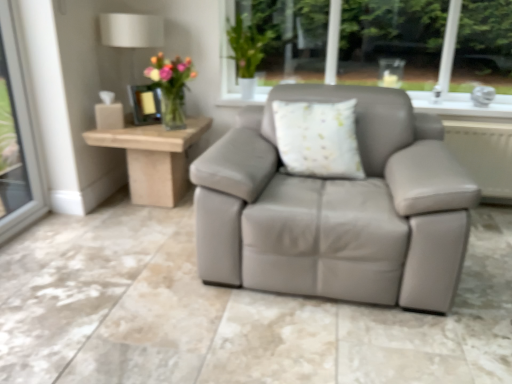
Question: Does metallic lampshade at upper left appear on the right side of green matte vase at upper center?

Choices:
 (A) yes
 (B) no

Answer: (B)

Question: From the image's perspective, would you say metallic lampshade at upper left is shown under green matte vase at upper center?

Choices:
 (A) no
 (B) yes

Answer: (B)

Question: Is metallic lampshade at upper left looking in the opposite direction of green matte vase at upper center?

Choices:
 (A) no
 (B) yes

Answer: (A)

Question: Are metallic lampshade at upper left and green matte vase at upper center far apart?

Choices:
 (A) no
 (B) yes

Answer: (A)

Question: Is metallic lampshade at upper left closer to the viewer compared to green matte vase at upper center?

Choices:
 (A) no
 (B) yes

Answer: (B)

Question: Is green matte vase at upper center surrounded by metallic lampshade at upper left?

Choices:
 (A) no
 (B) yes

Answer: (A)

Question: Can you confirm if light wood/roughobject at left is shorter than green matte vase at upper center?

Choices:
 (A) no
 (B) yes

Answer: (B)

Question: Is light wood/roughobject at left bigger than green matte vase at upper center?

Choices:
 (A) yes
 (B) no

Answer: (A)

Question: Considering the relative sizes of light wood/roughobject at left and green matte vase at upper center in the image provided, is light wood/roughobject at left taller than green matte vase at upper center?

Choices:
 (A) no
 (B) yes

Answer: (A)

Question: From a real-world perspective, is light wood/roughobject at left physically above green matte vase at upper center?

Choices:
 (A) yes
 (B) no

Answer: (B)

Question: Is light wood/roughobject at left oriented towards green matte vase at upper center?

Choices:
 (A) yes
 (B) no

Answer: (B)

Question: Is light wood/roughobject at left oriented away from green matte vase at upper center?

Choices:
 (A) yes
 (B) no

Answer: (B)

Question: Is light wood/roughobject at left bigger than translucent glass vase at upper left?

Choices:
 (A) yes
 (B) no

Answer: (A)